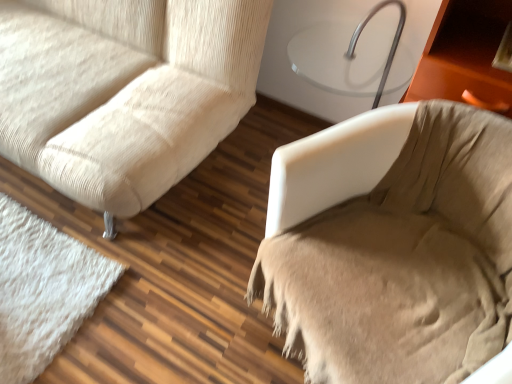
Question: Does beige textured fabric couch at left appear on the left side of beige fabric chair at right?

Choices:
 (A) no
 (B) yes

Answer: (B)

Question: Considering the relative sizes of beige textured fabric couch at left and beige fabric chair at right in the image provided, is beige textured fabric couch at left smaller than beige fabric chair at right?

Choices:
 (A) no
 (B) yes

Answer: (A)

Question: Is beige textured fabric couch at left wider than beige fabric chair at right?

Choices:
 (A) yes
 (B) no

Answer: (A)

Question: Does beige textured fabric couch at left have a lesser width compared to beige fabric chair at right?

Choices:
 (A) no
 (B) yes

Answer: (A)

Question: Is beige textured fabric couch at left next to beige fabric chair at right?

Choices:
 (A) yes
 (B) no

Answer: (B)

Question: Is beige textured fabric couch at left positioned before beige fabric chair at right?

Choices:
 (A) no
 (B) yes

Answer: (A)

Question: Is beige fabric chair at right directly adjacent to beige textured fabric couch at left?

Choices:
 (A) no
 (B) yes

Answer: (A)

Question: Does beige fabric chair at right have a greater width compared to beige textured fabric couch at left?

Choices:
 (A) yes
 (B) no

Answer: (B)

Question: Considering the relative positions of beige fabric chair at right and beige textured fabric couch at left in the image provided, is beige fabric chair at right in front of beige textured fabric couch at left?

Choices:
 (A) no
 (B) yes

Answer: (B)

Question: Is beige fabric chair at right taller than beige textured fabric couch at left?

Choices:
 (A) yes
 (B) no

Answer: (B)

Question: Is beige fabric chair at right thinner than beige textured fabric couch at left?

Choices:
 (A) no
 (B) yes

Answer: (B)

Question: Is beige fabric chair at right oriented away from beige textured fabric couch at left?

Choices:
 (A) yes
 (B) no

Answer: (B)

Question: Is beige fabric chair at right to the left or to the right of beige textured fabric couch at left in the image?

Choices:
 (A) right
 (B) left

Answer: (A)